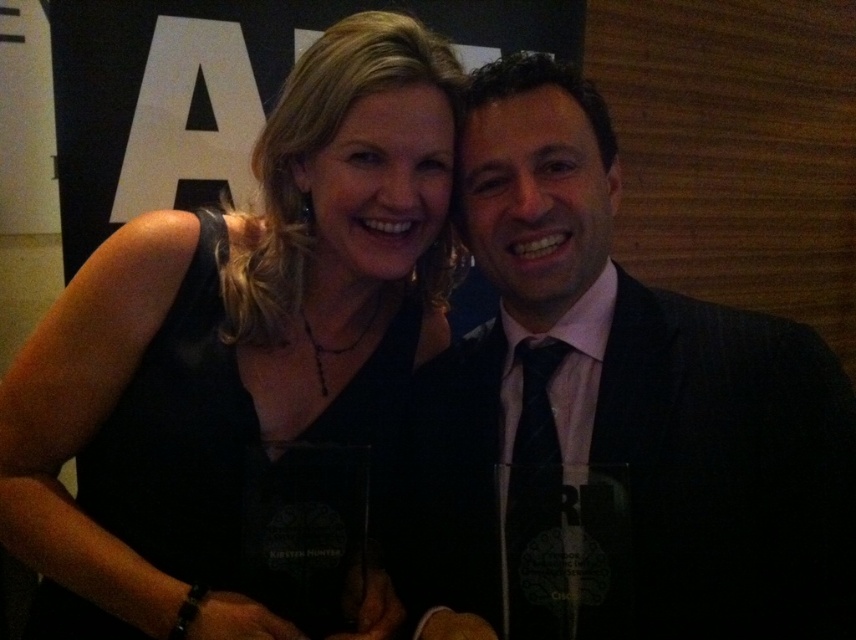
Question: Is black suit at right to the right of black silk tie at center from the viewer's perspective?

Choices:
 (A) yes
 (B) no

Answer: (A)

Question: Estimate the real-world distances between objects in this image. Which object is farther from the black matte dress at center?

Choices:
 (A) black silk tie at center
 (B) black suit at right

Answer: (A)

Question: Which of the following is the farthest from the observer?

Choices:
 (A) black suit at right
 (B) black matte dress at center

Answer: (B)

Question: Which of these objects is positioned closest to the black matte dress at center?

Choices:
 (A) black suit at right
 (B) black silk tie at center

Answer: (A)

Question: Is black matte dress at center closer to camera compared to black silk tie at center?

Choices:
 (A) yes
 (B) no

Answer: (B)

Question: Is black suit at right below black silk tie at center?

Choices:
 (A) no
 (B) yes

Answer: (A)